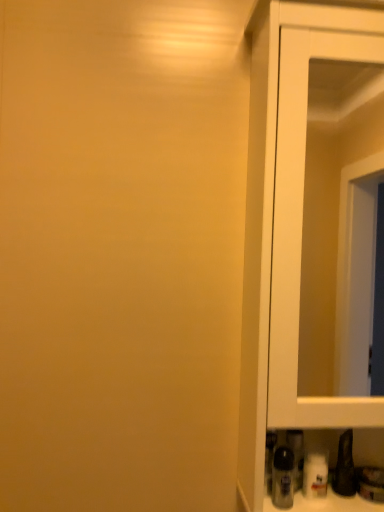
Question: Is translucent plastic bottle at lower right in front of or behind white glossy cupboard at right in the image?

Choices:
 (A) behind
 (B) front

Answer: (A)

Question: Is translucent plastic bottle at lower right bigger or smaller than white glossy cupboard at right?

Choices:
 (A) big
 (B) small

Answer: (B)

Question: Is translucent plastic bottle at lower right wider or thinner than white glossy cupboard at right?

Choices:
 (A) wide
 (B) thin

Answer: (B)

Question: From the image's perspective, is white glossy cupboard at right above or below translucent plastic bottle at lower right?

Choices:
 (A) below
 (B) above

Answer: (B)

Question: Would you say white glossy cupboard at right is to the left or to the right of translucent plastic bottle at lower right in the picture?

Choices:
 (A) right
 (B) left

Answer: (A)

Question: In terms of height, does white glossy cupboard at right look taller or shorter compared to translucent plastic bottle at lower right?

Choices:
 (A) short
 (B) tall

Answer: (B)

Question: Is point (253, 182) closer or farther from the camera than point (276, 495)?

Choices:
 (A) closer
 (B) farther

Answer: (B)